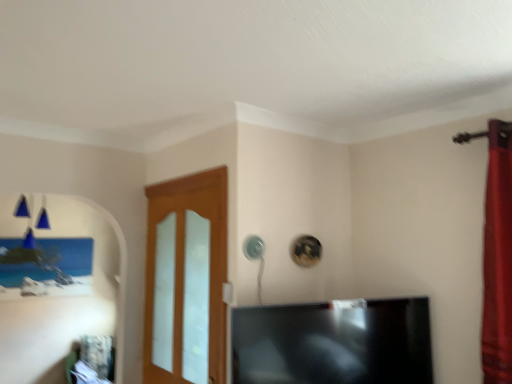
Question: Considering the positions of point (254, 322) and point (192, 292), is point (254, 322) closer or farther from the camera than point (192, 292)?

Choices:
 (A) farther
 (B) closer

Answer: (B)

Question: Would you say black glossy tv at center is inside or outside light wood/glass door at center?

Choices:
 (A) outside
 (B) inside

Answer: (A)

Question: In the image, is black glossy tv at center positioned in front of or behind light wood/glass door at center?

Choices:
 (A) front
 (B) behind

Answer: (A)

Question: Is light wood/glass door at center situated inside black glossy tv at center or outside?

Choices:
 (A) outside
 (B) inside

Answer: (A)

Question: From their relative heights in the image, would you say light wood/glass door at center is taller or shorter than black glossy tv at center?

Choices:
 (A) tall
 (B) short

Answer: (A)

Question: In the image, is light wood/glass door at center on the left side or the right side of black glossy tv at center?

Choices:
 (A) left
 (B) right

Answer: (A)

Question: Relative to black glossy tv at center, is light wood/glass door at center in front or behind?

Choices:
 (A) behind
 (B) front

Answer: (A)